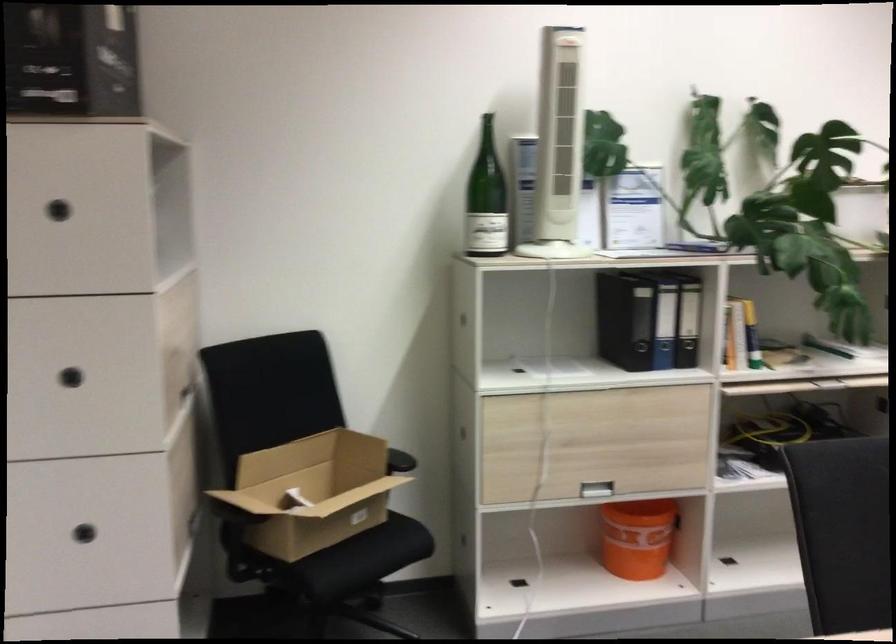
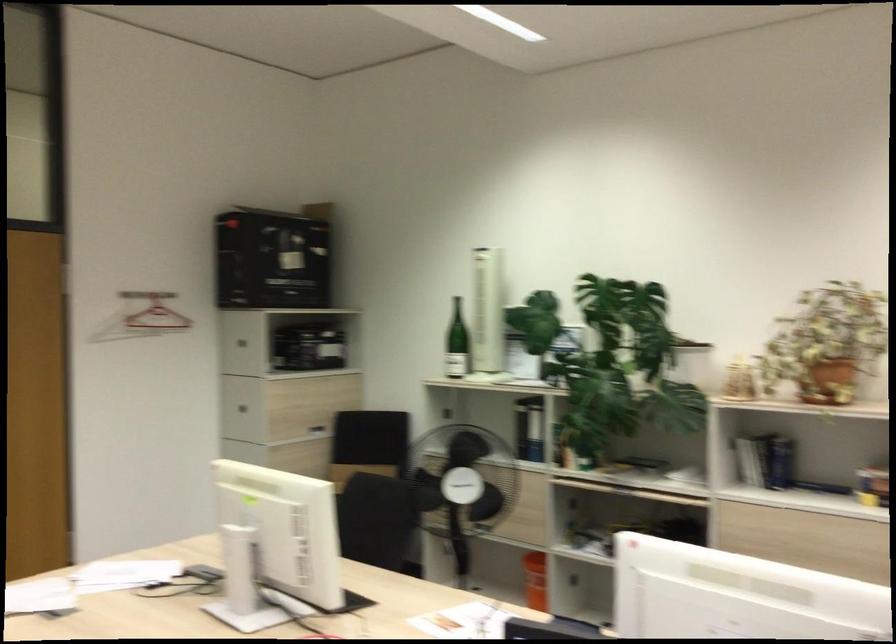
Question: I am providing you with two images of the same scene from different viewpoints. Which of the following objects are not visible in image2?

Choices:
 (A) blue ring binder
 (B) red clothes hanger
 (C) blue plastic bin
 (D) drawer pull

Answer: (A)